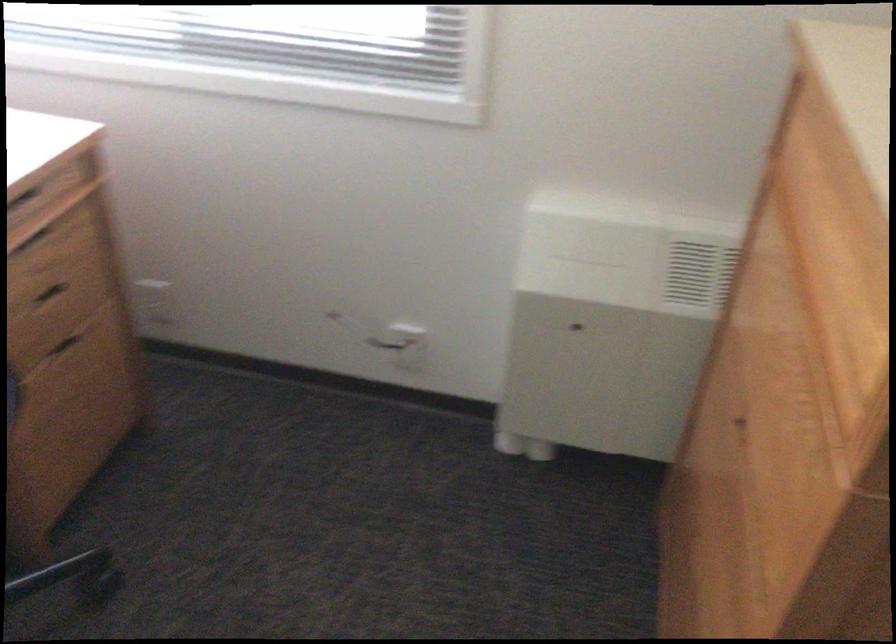
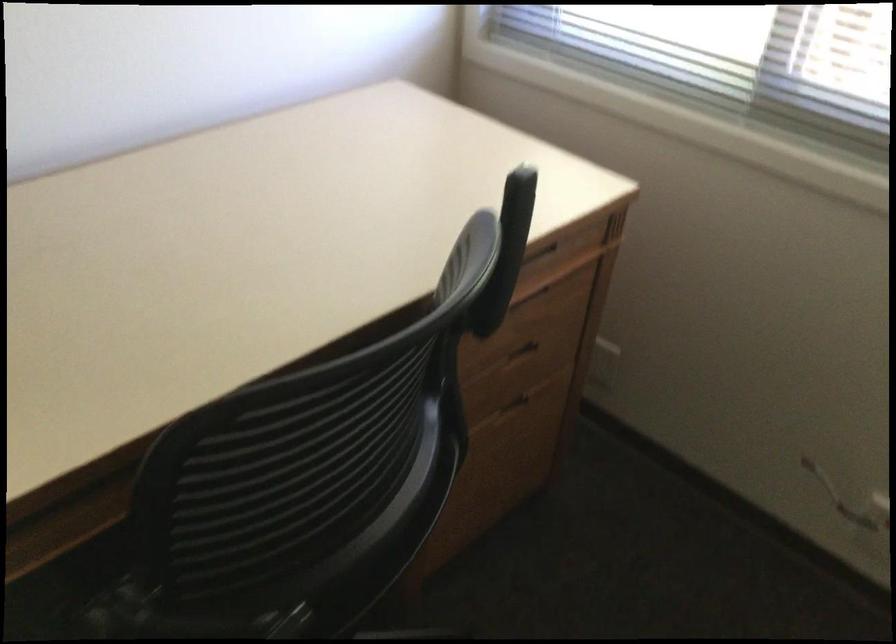
Question: Based on the continuous images, in which direction is the camera rotating? Reply with the corresponding letter.

Choices:
 (A) Left
 (B) Right
 (C) Up
 (D) Down

Answer: (A)